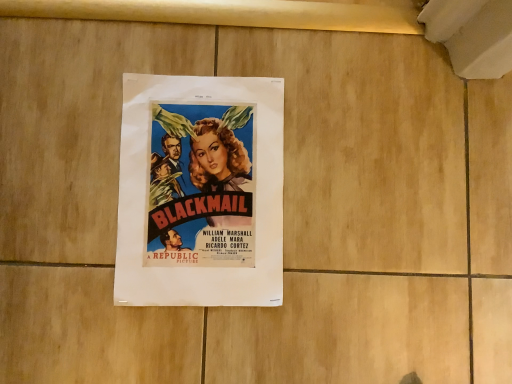
Identify the location of free space above matte paper poster at center (from a real-world perspective). (200, 187).